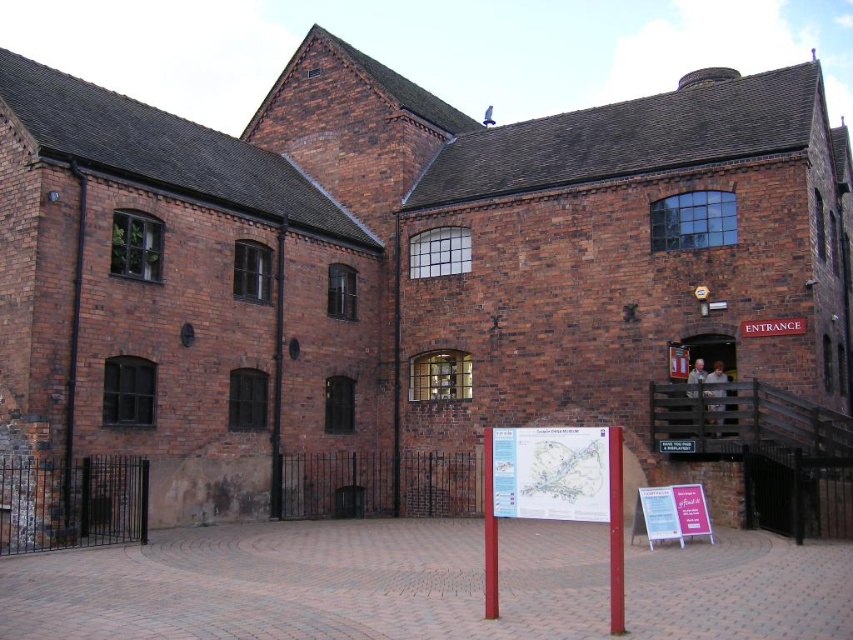
Can you confirm if light blue paper map at center is positioned to the left of smooth wooden pole at center?

In fact, light blue paper map at center is to the right of smooth wooden pole at center.

Describe the element at coordinates (550, 472) in the screenshot. The width and height of the screenshot is (853, 640). I see `light blue paper map at center` at that location.

Which is behind, point (579, 436) or point (488, 515)?

Positioned behind is point (488, 515).

You are a GUI agent. You are given a task and a screenshot of the screen. Output one action in this format:
    pyautogui.click(x=<x>, y=<y>)
    Task: Click on the light blue paper map at center
    
    Given the screenshot: What is the action you would take?
    pyautogui.click(x=550, y=472)

Locate an element on the screen. This screenshot has height=640, width=853. smooth red pole at center is located at coordinates (614, 531).

Between smooth red pole at center and red brick sign at center, which one appears on the left side from the viewer's perspective?

Positioned to the left is smooth red pole at center.

Locate an element on the screen. This screenshot has height=640, width=853. smooth red pole at center is located at coordinates (614, 531).

Consider the image. Who is positioned more to the left, smooth red pole at center or wooden gate at center?

smooth red pole at center is more to the left.

From the picture: Is smooth red pole at center in front of wooden gate at center?

Yes, smooth red pole at center is in front of wooden gate at center.

Locate an element on the screen. smooth red pole at center is located at coordinates (614, 531).

Locate an element on the screen. The height and width of the screenshot is (640, 853). smooth red pole at center is located at coordinates (614, 531).